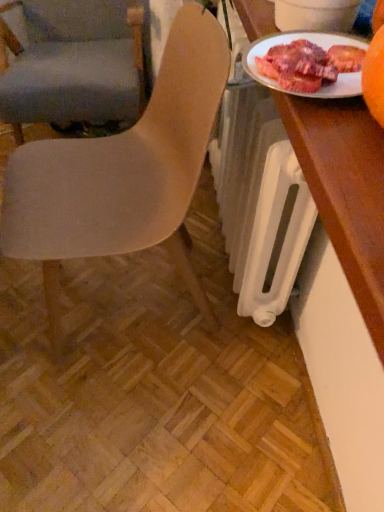
Question: From a real-world perspective, is wooden desk at right physically above matte gray chair at left, the second chair from the front?

Choices:
 (A) no
 (B) yes

Answer: (B)

Question: Is wooden desk at right to the right of matte gray chair at left, the second chair from the front, from the viewer's perspective?

Choices:
 (A) yes
 (B) no

Answer: (A)

Question: Is wooden desk at right not close to matte gray chair at left, the second chair from the front?

Choices:
 (A) no
 (B) yes

Answer: (B)

Question: Is wooden desk at right further to the viewer compared to matte gray chair at left, marked as the first chair in a back-to-front arrangement?

Choices:
 (A) yes
 (B) no

Answer: (B)

Question: Considering the relative sizes of wooden desk at right and matte gray chair at left, the second chair from the front, in the image provided, is wooden desk at right thinner than matte gray chair at left, the second chair from the front,?

Choices:
 (A) yes
 (B) no

Answer: (A)

Question: Can you confirm if wooden desk at right is wider than matte gray chair at left, marked as the first chair in a back-to-front arrangement?

Choices:
 (A) no
 (B) yes

Answer: (A)

Question: Is matte beige chair at center, which is the first chair in front-to-back order, smaller than white glossy plate at upper right?

Choices:
 (A) yes
 (B) no

Answer: (B)

Question: Is matte beige chair at center, which is the first chair in front-to-back order, to the right of white glossy plate at upper right from the viewer's perspective?

Choices:
 (A) no
 (B) yes

Answer: (A)

Question: Is matte beige chair at center, which is the first chair in front-to-back order, outside of white glossy plate at upper right?

Choices:
 (A) no
 (B) yes

Answer: (B)

Question: Can you confirm if matte beige chair at center, which is the first chair in front-to-back order, is shorter than white glossy plate at upper right?

Choices:
 (A) yes
 (B) no

Answer: (B)

Question: Does matte beige chair at center, which is the first chair in front-to-back order, have a greater width compared to white glossy plate at upper right?

Choices:
 (A) yes
 (B) no

Answer: (A)

Question: From a real-world perspective, is matte beige chair at center, which is the first chair in front-to-back order, on white glossy plate at upper right?

Choices:
 (A) no
 (B) yes

Answer: (A)

Question: Is matte beige chair at center, which is the first chair in front-to-back order, taller than wooden desk at right?

Choices:
 (A) no
 (B) yes

Answer: (B)